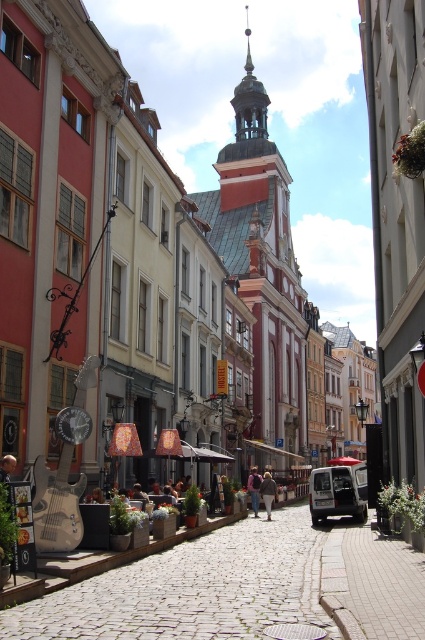
Question: From the image, what is the correct spatial relationship of dark brown leather jacket at center in relation to smooth wooden guitar at left?

Choices:
 (A) right
 (B) left

Answer: (A)

Question: Is cobblestone alley at center to the left of white matte van at center from the viewer's perspective?

Choices:
 (A) yes
 (B) no

Answer: (A)

Question: Which object is positioned closest to the smooth wooden guitar at left?

Choices:
 (A) brown leather jacket at center
 (B) white matte van at center
 (C) cobblestone alley at center

Answer: (C)

Question: From the image, what is the correct spatial relationship of cobblestone alley at center in relation to white matte van at center?

Choices:
 (A) left
 (B) right

Answer: (A)

Question: Which point appears farthest from the camera in this image?

Choices:
 (A) (252, 497)
 (B) (260, 493)
 (C) (2, 456)
 (D) (314, 515)

Answer: (A)

Question: Estimate the real-world distances between objects in this image. Which object is farther from the white matte van at center?

Choices:
 (A) dark brown leather jacket at center
 (B) smooth wooden guitar at left
 (C) cobblestone alley at center

Answer: (B)